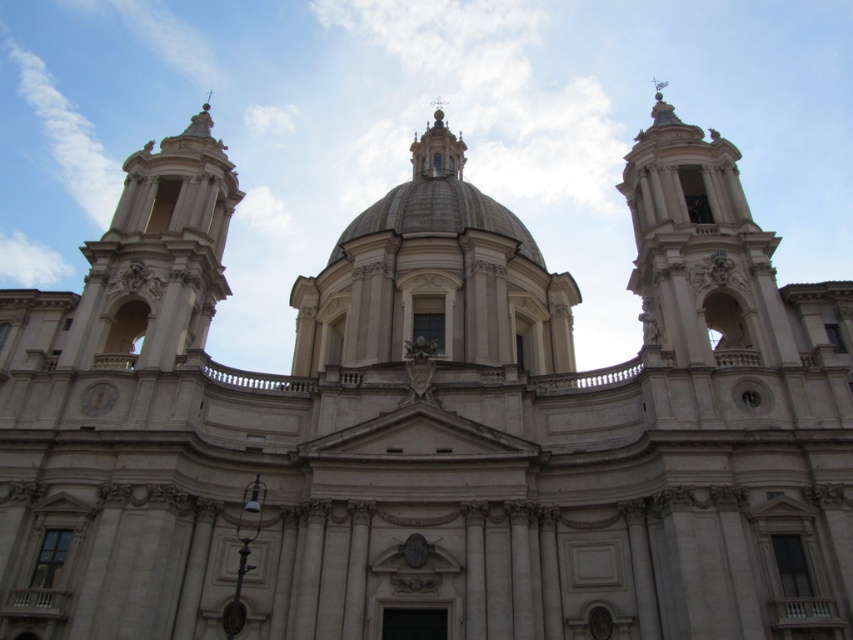
You are an architect evaluating the proportions of the building. Which object, the white marble dome at center or the white marble clock at lower left, is taller?

The white marble dome at center is taller than the white marble clock at lower left.

You are standing in front of the grand classical building. You see the white stone tower at left and the white marble dome at center. Which object is closer to you?

The white stone tower at left is closer to you because it is in front of the white marble dome at center.